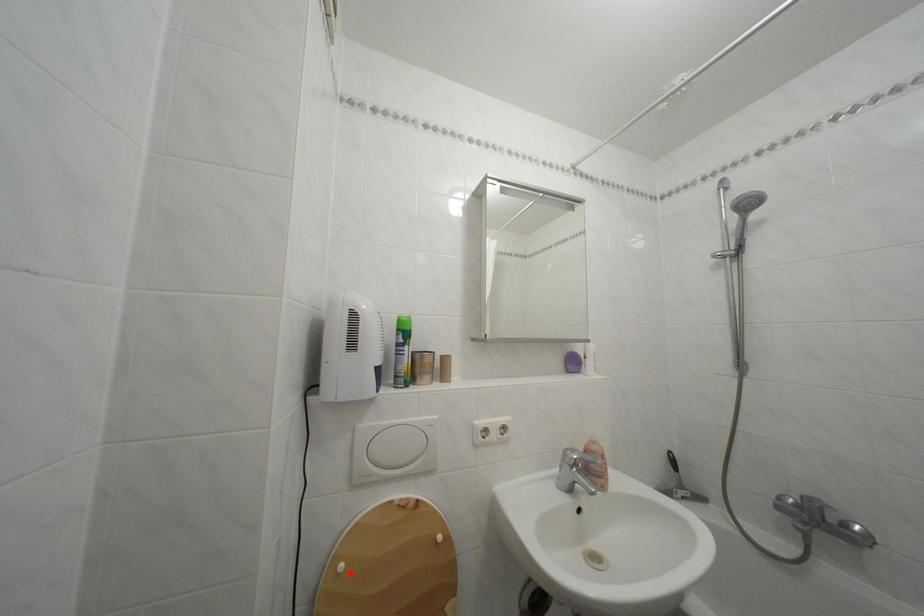
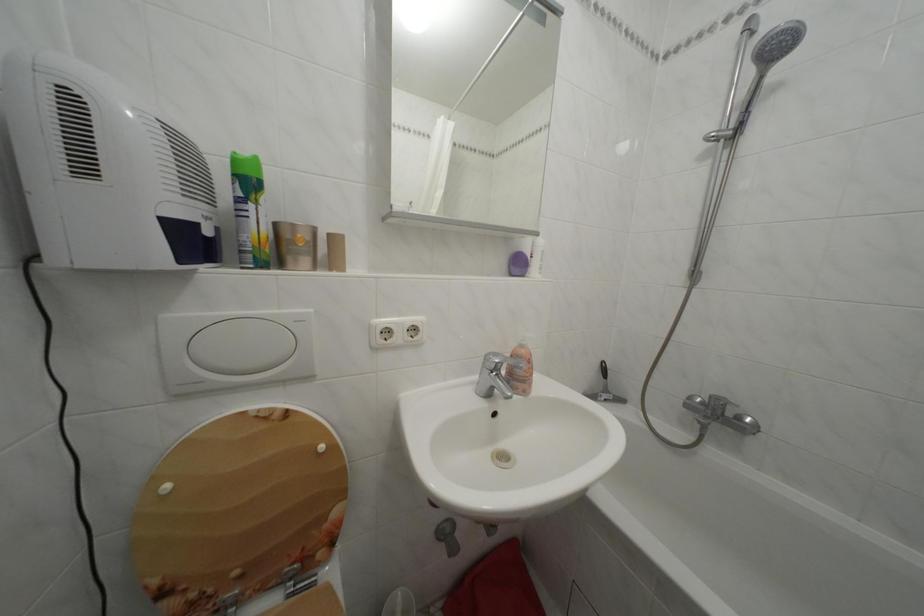
In the second image, find the point that corresponds to the highlighted location in the first image.

(176, 493)